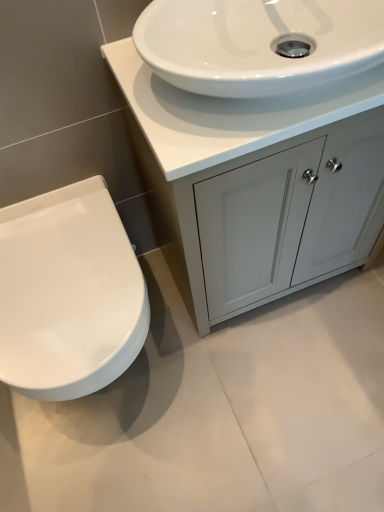
This screenshot has height=512, width=384. Find the location of `vacant space that's between white glossy toilet at left and matte white cabinet at center`. vacant space that's between white glossy toilet at left and matte white cabinet at center is located at coordinates (244, 329).